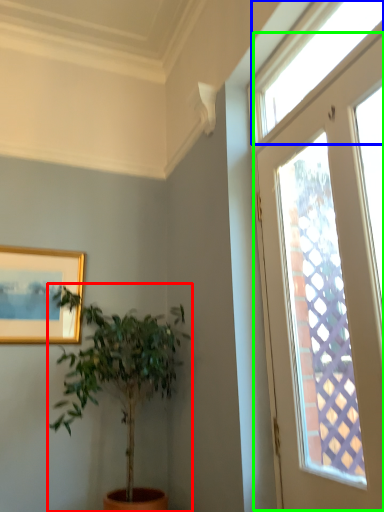
Question: Based on their relative distances, which object is nearer to houseplant (highlighted by a red box)? Choose from window (highlighted by a blue box) and window (highlighted by a green box).

Choices:
 (A) window
 (B) window

Answer: (B)